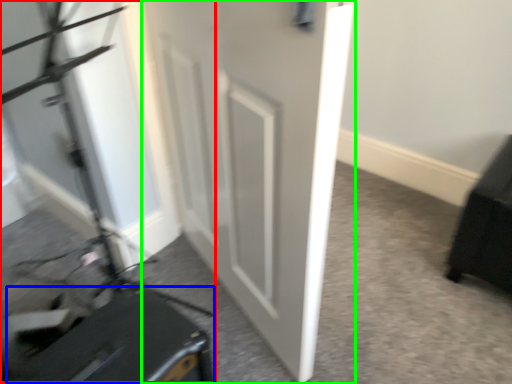
Question: Which object is the farthest from videotape (highlighted by a red box)? Choose among these: luggage (highlighted by a blue box) or door (highlighted by a green box).

Choices:
 (A) luggage
 (B) door

Answer: (B)